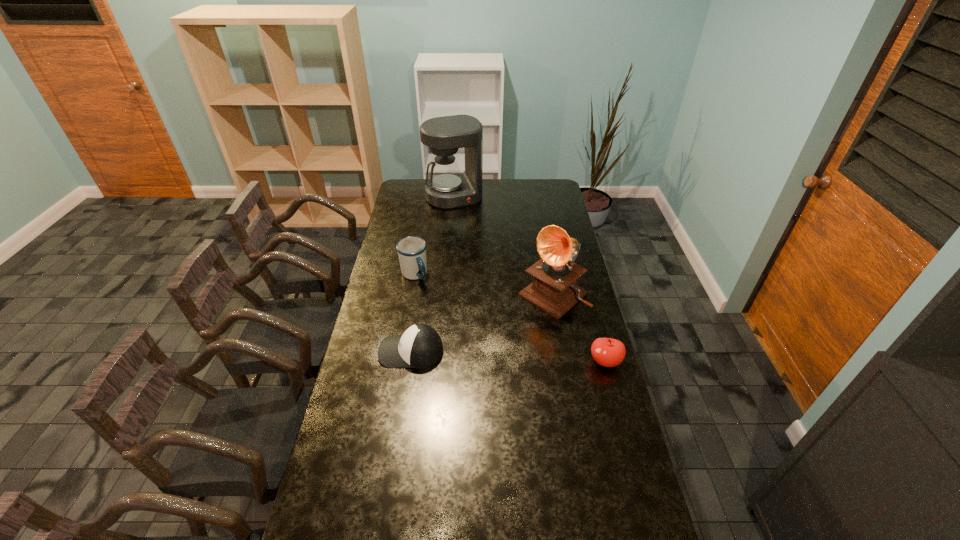
This screenshot has height=540, width=960. Find the location of `vacant space located 0.180m on the horn of the phonograph record`. vacant space located 0.180m on the horn of the phonograph record is located at coordinates (502, 336).

Identify the location of vacant space located on the horn of the phonograph record. (512, 328).

I want to click on free spot located on the front-facing side of the farthest object, so click(x=476, y=241).

Locate an element on the screen. The image size is (960, 540). free location located 0.250m on the front-facing side of the farthest object is located at coordinates (473, 235).

I want to click on vacant region located 0.370m on the front-facing side of the farthest object, so click(480, 248).

Where is `object at the far edge`? The height and width of the screenshot is (540, 960). object at the far edge is located at coordinates (448, 188).

At what (x,y) coordinates should I click in order to perform the action: click on cap that is at the left edge. Please return your answer as a coordinate pair (x, y). This screenshot has height=540, width=960. Looking at the image, I should click on (420, 346).

What are the coordinates of `mug present at the left edge` in the screenshot? It's located at point(411,250).

The image size is (960, 540). Identify the location of coffee maker that is at the left edge. (448, 188).

The width and height of the screenshot is (960, 540). Find the location of `apple that is at the right edge`. apple that is at the right edge is located at coordinates (607, 352).